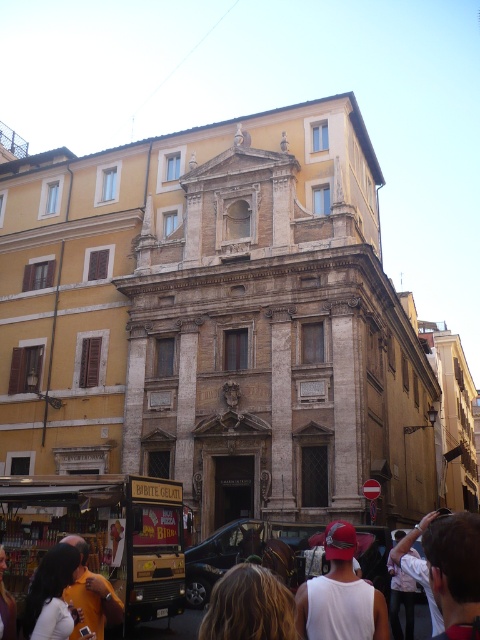
You are a tourist standing in front of the historic building and want to take a photo of the blonde hair at lower center and the white cotton shirt at lower left. Which one should you focus on first to ensure both are in focus?

You should focus on the blonde hair at lower center first because it is closer to the viewer than the white cotton shirt at lower left, so focusing on the closer object will help both be in focus.

What is the position of the point marked at coordinates [250,605] in the image?

The point marked at coordinates [250,605] corresponds to the location of the blonde hair at lower center.

You are a tourist standing in front of the historic building and see the blonde hair at lower center and the white cotton shirt at lower left. Which of these two items is positioned lower in the image?

The blonde hair at lower center is located below the white cotton shirt at lower left, so it is positioned lower in the image.